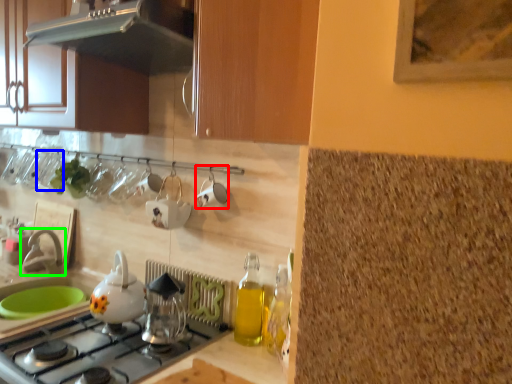
Question: Considering the real-world distances, which object is closest to tableware (highlighted by a red box)? tableware (highlighted by a blue box) or tap (highlighted by a green box).

Choices:
 (A) tableware
 (B) tap

Answer: (B)